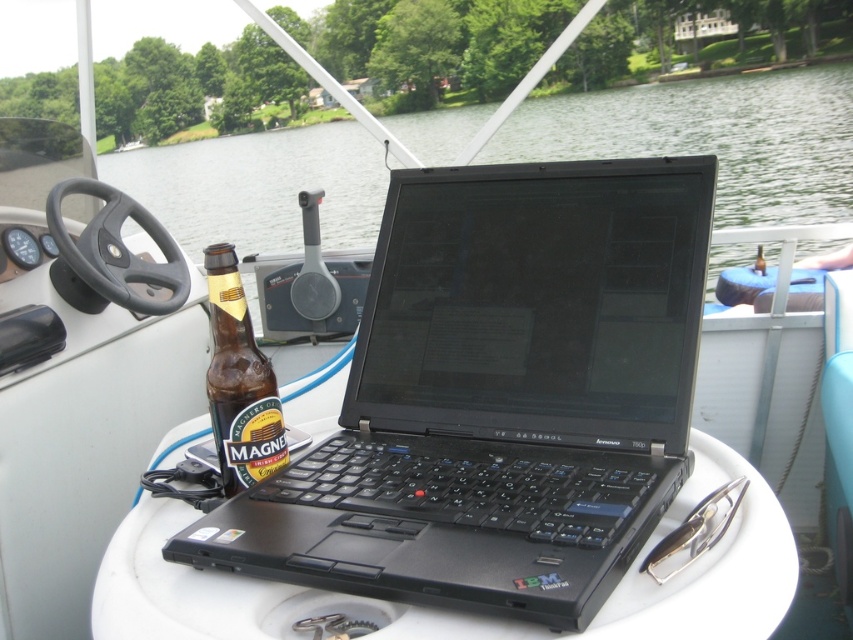
Question: Which object is positioned closest to the white plastic table at center?

Choices:
 (A) brown glass bottle at center
 (B) brown glass bottle at left
 (C) clear water at center

Answer: (B)

Question: Where is brown glass bottle at left located in relation to brown glass bottle at center in the image?

Choices:
 (A) above
 (B) below

Answer: (B)

Question: Which of these objects is positioned closest to the brown glass bottle at center?

Choices:
 (A) clear water at center
 (B) black plastic laptop at center
 (C) white plastic table at center

Answer: (B)

Question: Which object is farther from the camera taking this photo?

Choices:
 (A) black plastic laptop at center
 (B) brown glass bottle at left
 (C) white plastic table at center

Answer: (B)

Question: Does brown glass bottle at left come behind brown glass bottle at center?

Choices:
 (A) yes
 (B) no

Answer: (B)

Question: Does clear water at center appear under white plastic table at center?

Choices:
 (A) yes
 (B) no

Answer: (B)